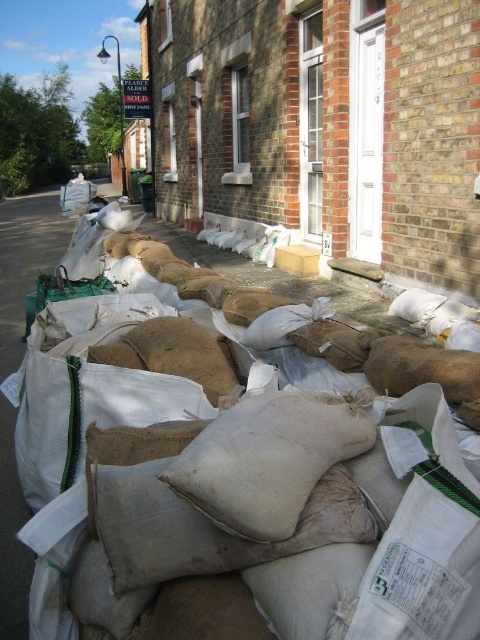
Question: Which point is closer to the camera taking this photo?

Choices:
 (A) (2, 316)
 (B) (178, 573)

Answer: (B)

Question: Is beige fabric pillow at center smaller than burlap sack at center?

Choices:
 (A) no
 (B) yes

Answer: (B)

Question: Which point is closer to the camera taking this photo?

Choices:
 (A) (25, 237)
 (B) (147, 522)

Answer: (B)

Question: Among these objects, which one is nearest to the camera?

Choices:
 (A) beige fabric pillow at center
 (B) burlap sack at center

Answer: (A)

Question: Is beige fabric pillow at center smaller than burlap sack at center?

Choices:
 (A) no
 (B) yes

Answer: (B)

Question: Does beige fabric pillow at center appear on the left side of burlap sack at center?

Choices:
 (A) yes
 (B) no

Answer: (B)